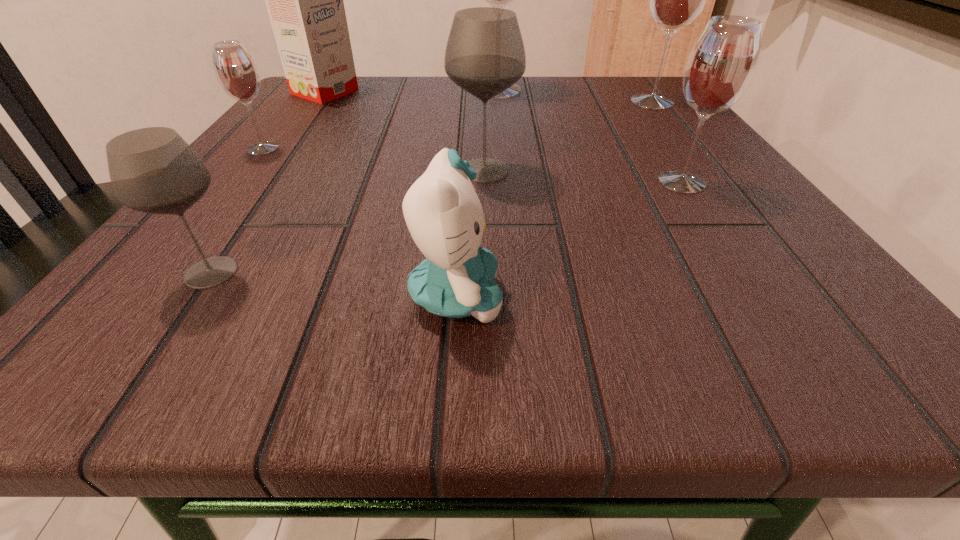
Where is `vacant region at the near left corner`? This screenshot has width=960, height=540. vacant region at the near left corner is located at coordinates (123, 306).

This screenshot has width=960, height=540. I want to click on free space at the near right corner of the desktop, so click(757, 334).

Locate an element on the screen. The image size is (960, 540). free space between the second red wineglass from left to right and the kitten is located at coordinates pyautogui.click(x=476, y=194).

I want to click on vacant region between the carton and the nearest wineglass, so click(268, 182).

Find the location of a particular element. unoccupied position between the third smallest red wineglass and the blue kitten is located at coordinates (554, 200).

In order to click on vacant point located between the third red wineglass from right to left and the bigger gray wineglass in this screenshot , I will do (x=491, y=131).

Identify the location of free space that is in between the farther gray wineglass and the third farthest red wineglass. (373, 159).

Where is `empty space that is in between the carton and the kitten`? The width and height of the screenshot is (960, 540). empty space that is in between the carton and the kitten is located at coordinates (391, 194).

The image size is (960, 540). Identify the location of free space between the nearest wineglass and the third red wineglass from right to left. (354, 181).

Where is `vacant area between the smallest red wineglass and the carton`? The height and width of the screenshot is (540, 960). vacant area between the smallest red wineglass and the carton is located at coordinates (294, 120).